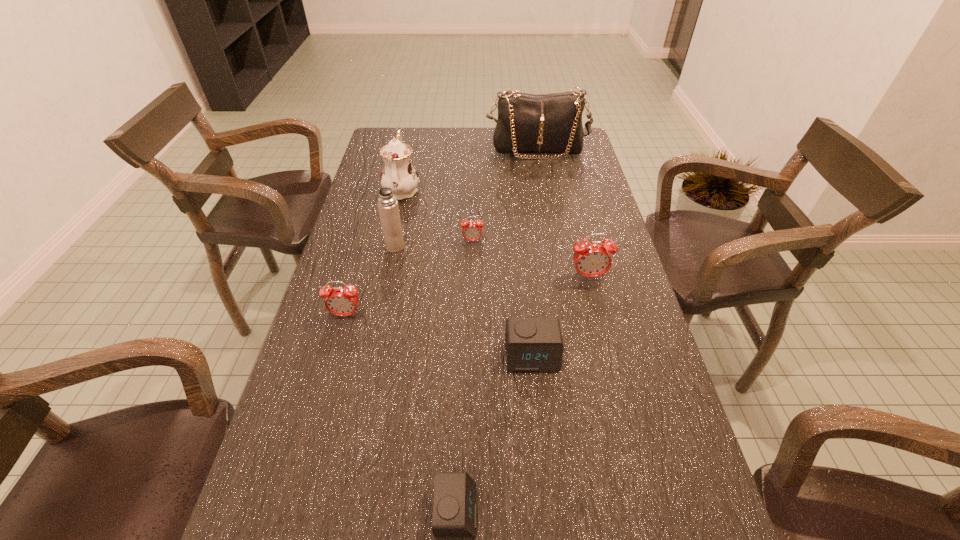
Identify the location of the second nearest object. [x=532, y=344].

This screenshot has width=960, height=540. In order to click on the fourth alarm clock from left to right in this screenshot , I will do `click(532, 344)`.

Locate an element on the screen. the left black alarm clock is located at coordinates [454, 509].

The image size is (960, 540). What are the coordinates of `the nearer black alarm clock` in the screenshot? It's located at (454, 509).

Where is `free space located 0.180m at the front of the farthest object with chain and zipper`? This screenshot has width=960, height=540. free space located 0.180m at the front of the farthest object with chain and zipper is located at coordinates (543, 190).

Where is `vacant area situated on the back of the chinaware`? vacant area situated on the back of the chinaware is located at coordinates (413, 139).

You are a GUI agent. You are given a task and a screenshot of the screen. Output one action in this format:
    pyautogui.click(x=<x>, y=<y>)
    Task: Click on the vacant space positioned on the right of the thermos bottle
    
    Given the screenshot: What is the action you would take?
    pyautogui.click(x=456, y=246)

Where is `vacant area located 0.290m on the face of the fifth shortest object`? The width and height of the screenshot is (960, 540). vacant area located 0.290m on the face of the fifth shortest object is located at coordinates (613, 376).

The image size is (960, 540). I want to click on vacant space positioned on the face of the leftmost red alarm clock, so click(x=301, y=474).

Locate an element on the screen. vacant space located 0.260m on the face of the farthest alarm clock is located at coordinates (471, 312).